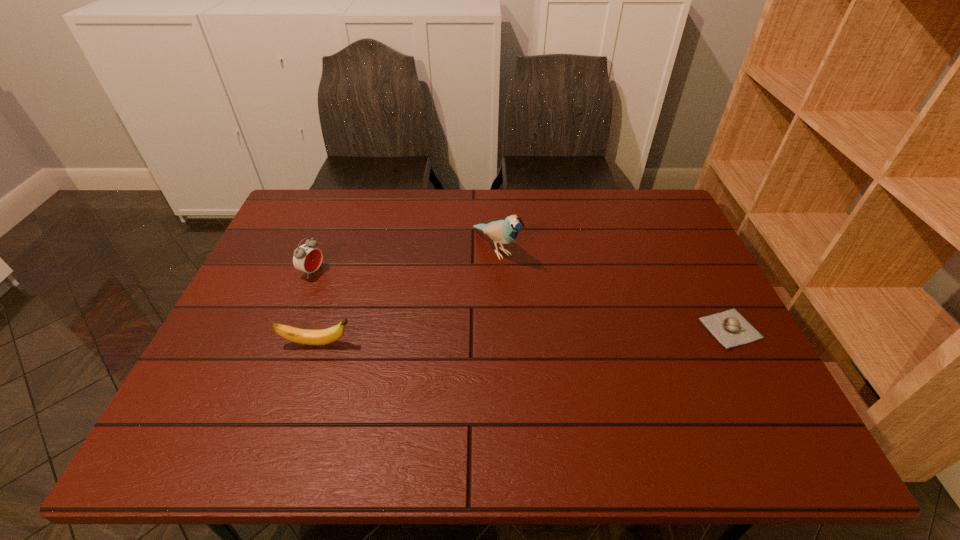
Locate an element on the screen. The height and width of the screenshot is (540, 960). free space in the image that satisfies the following two spatial constraints: 1. on the back side of the third shortest object; 2. on the left side of the second object from right to left is located at coordinates (322, 248).